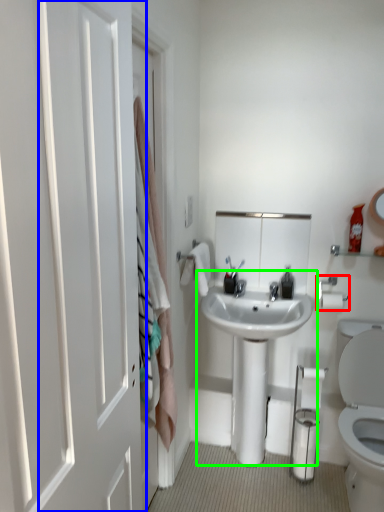
Question: Based on their relative distances, which object is farther from towel bar (highlighted by a red box)? Choose from door (highlighted by a blue box) and sink (highlighted by a green box).

Choices:
 (A) door
 (B) sink

Answer: (A)